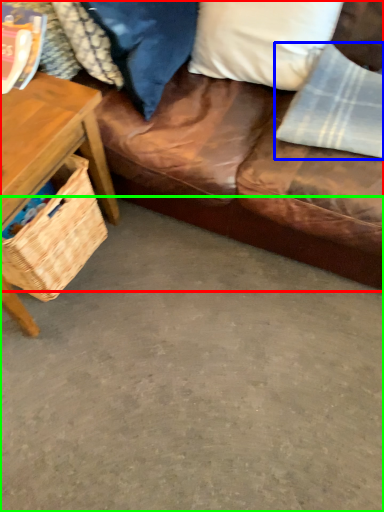
Question: Which object is positioned closest to studio couch (highlighted by a red box)? Select from material (highlighted by a blue box) and concrete (highlighted by a green box).

Choices:
 (A) material
 (B) concrete

Answer: (A)